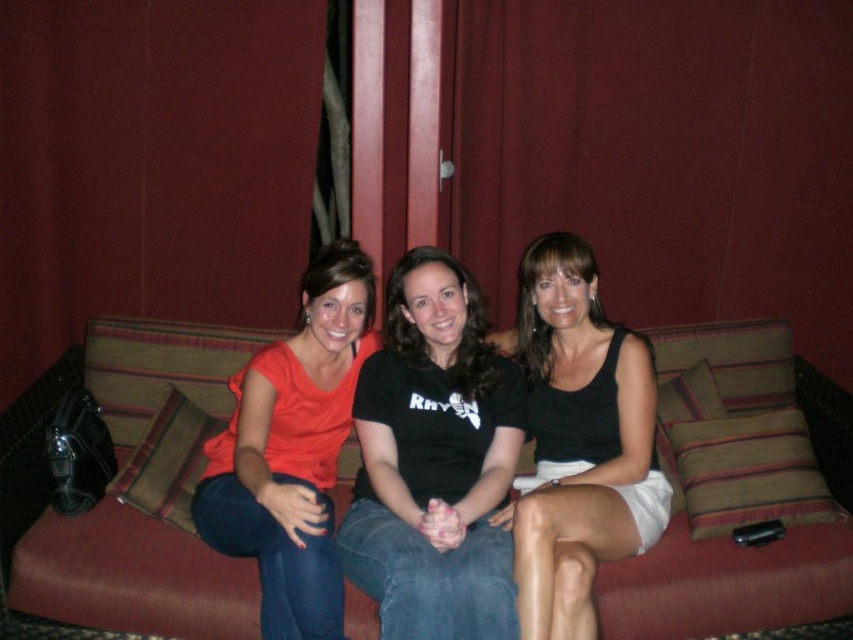
Does point (793, 570) come behind point (445, 518)?

Yes.

Is textured fabric couch at center bigger than black matte t-shirt at center?

Actually, textured fabric couch at center might be smaller than black matte t-shirt at center.

This screenshot has width=853, height=640. Identify the location of textured fabric couch at center. (131, 577).

At what (x,y) coordinates should I click in order to perform the action: click on textured fabric couch at center. Please return your answer as a coordinate pair (x, y). The width and height of the screenshot is (853, 640). Looking at the image, I should click on (131, 577).

This screenshot has width=853, height=640. Describe the element at coordinates (578, 440) in the screenshot. I see `black matte tank top at center` at that location.

Is black matte tank top at center positioned behind matte orange shirt at center?

Yes.

Locate an element on the screen. The image size is (853, 640). black matte tank top at center is located at coordinates coord(578,440).

Looking at this image, measure the distance between black matte t-shirt at center and matte orange shirt at center.

A distance of 8.20 inches exists between black matte t-shirt at center and matte orange shirt at center.

I want to click on black matte t-shirt at center, so click(434, 461).